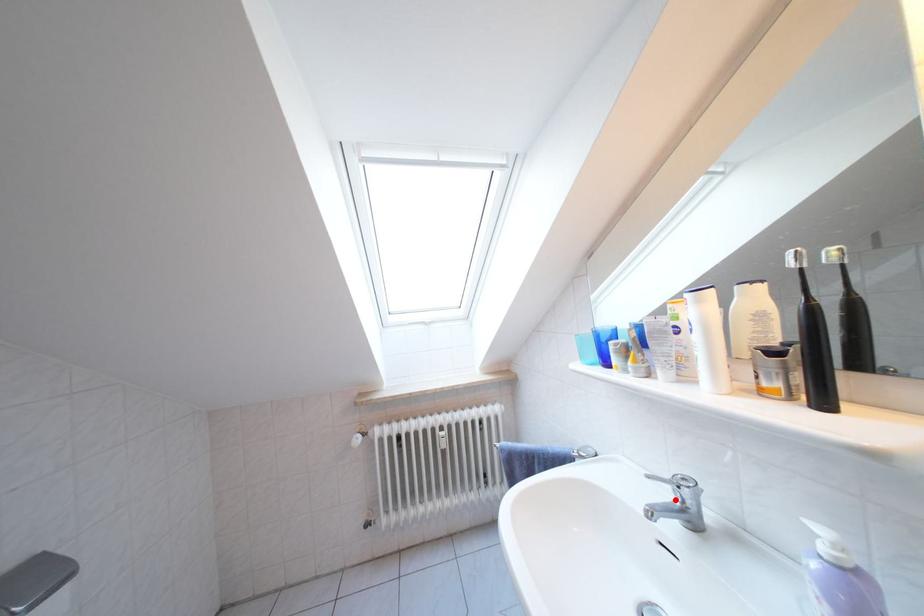
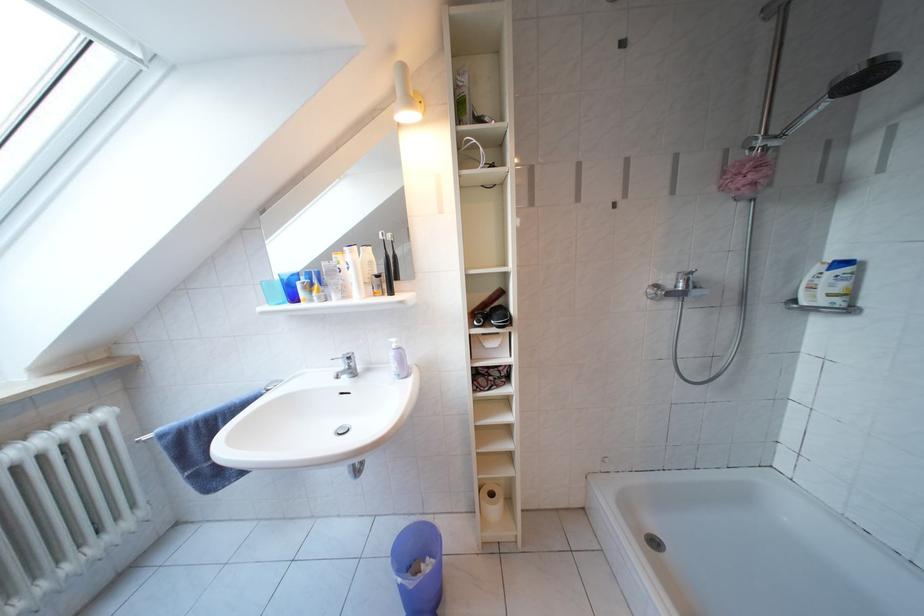
Question: I am providing you with two images of the same scene from different viewpoints. Image1 has a red point marked. In image2, the corresponding 3D location appears at what relative position? Reply with the corresponding letter.

Choices:
 (A) Closer
 (B) Farther

Answer: (A)